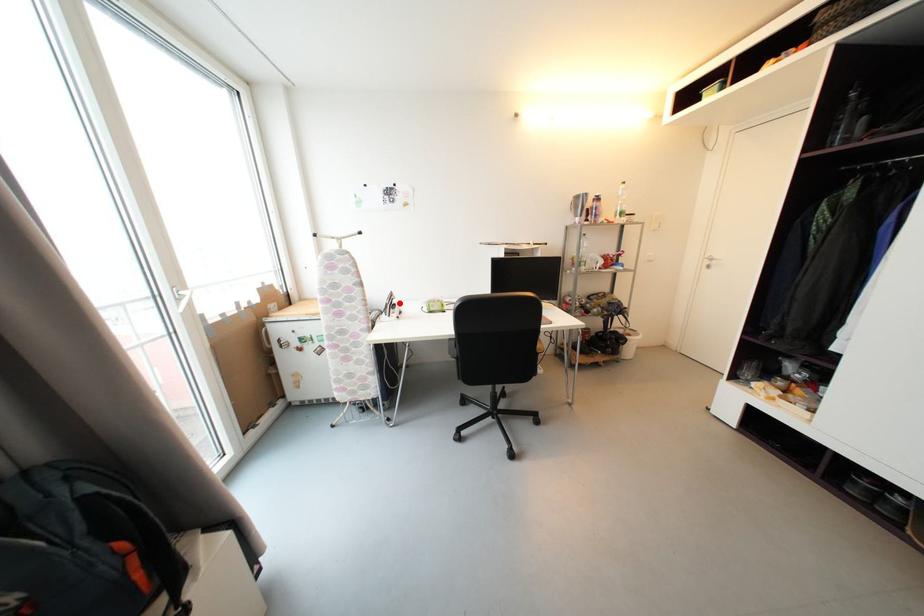
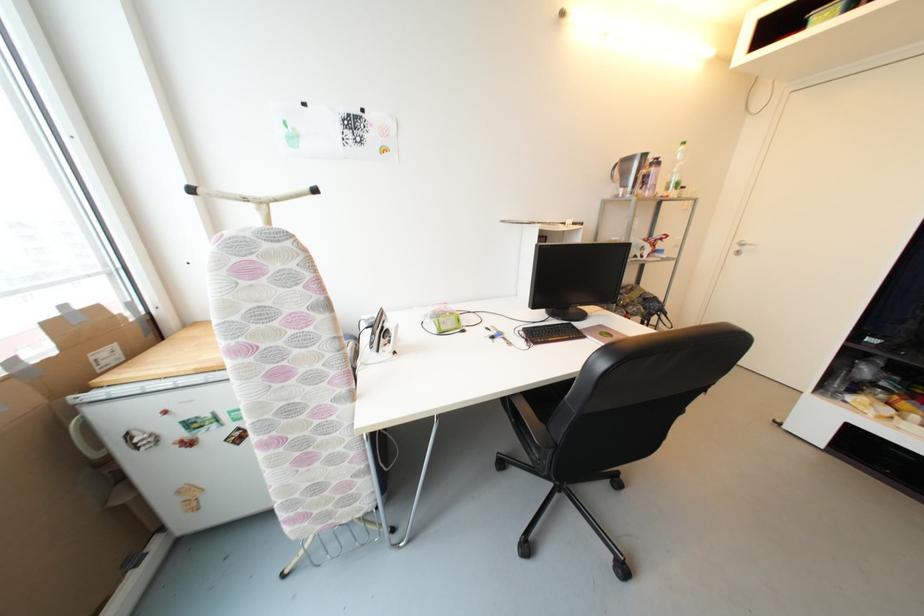
Question: I am providing you with two images of the same scene from different viewpoints. In image1, a red point is highlighted. Considering the same 3D point in image2, which of the following is correct?

Choices:
 (A) It is closer
 (B) It is farther

Answer: (B)